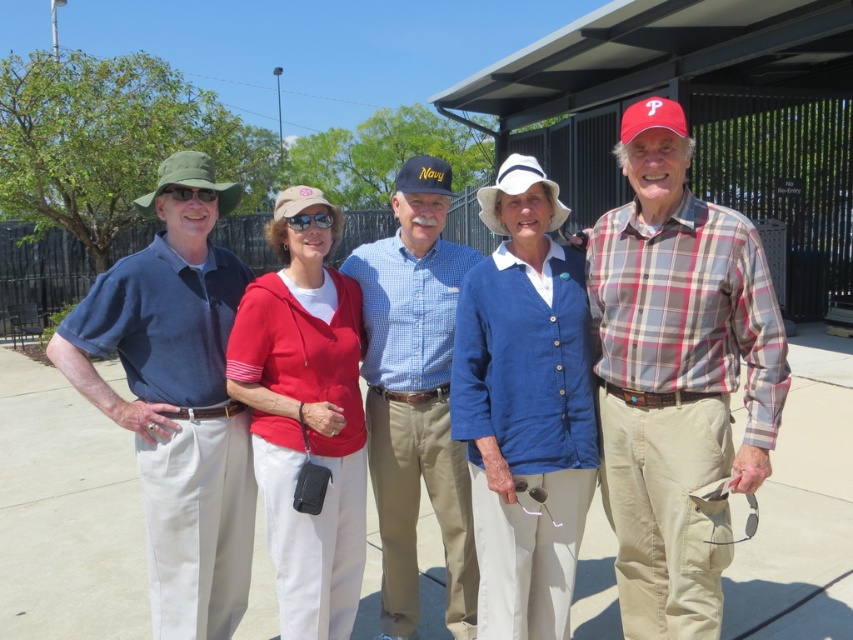
Who is shorter, matte red hoodie at center or navy fabric baseball cap at center?

Standing shorter between the two is navy fabric baseball cap at center.

Is matte red hoodie at center below navy fabric baseball cap at center?

Indeed, matte red hoodie at center is positioned under navy fabric baseball cap at center.

Who is more forward, (259, 280) or (442, 188)?

Positioned in front is point (259, 280).

Locate an element on the screen. This screenshot has width=853, height=640. matte red hoodie at center is located at coordinates (305, 420).

From the picture: Does blue linen cardigan at center appear on the right side of red fabric baseball cap at right?

Incorrect, blue linen cardigan at center is not on the right side of red fabric baseball cap at right.

From the picture: Can you confirm if blue linen cardigan at center is thinner than red fabric baseball cap at right?

No.

Who is more distant from viewer, (537, 342) or (643, 100)?

Positioned behind is point (643, 100).

You are a GUI agent. You are given a task and a screenshot of the screen. Output one action in this format:
    pyautogui.click(x=<x>, y=<y>)
    Task: Click on the blue linen cardigan at center
    
    Given the screenshot: What is the action you would take?
    pyautogui.click(x=524, y=406)

Which is more to the left, plaid cotton shirt at right or matte blue shirt at left?

matte blue shirt at left is more to the left.

Does plaid cotton shirt at right have a smaller size compared to matte blue shirt at left?

Actually, plaid cotton shirt at right might be larger than matte blue shirt at left.

Where is `plaid cotton shirt at right`? plaid cotton shirt at right is located at coordinates (677, 381).

Image resolution: width=853 pixels, height=640 pixels. In order to click on plaid cotton shirt at right in this screenshot , I will do (677, 381).